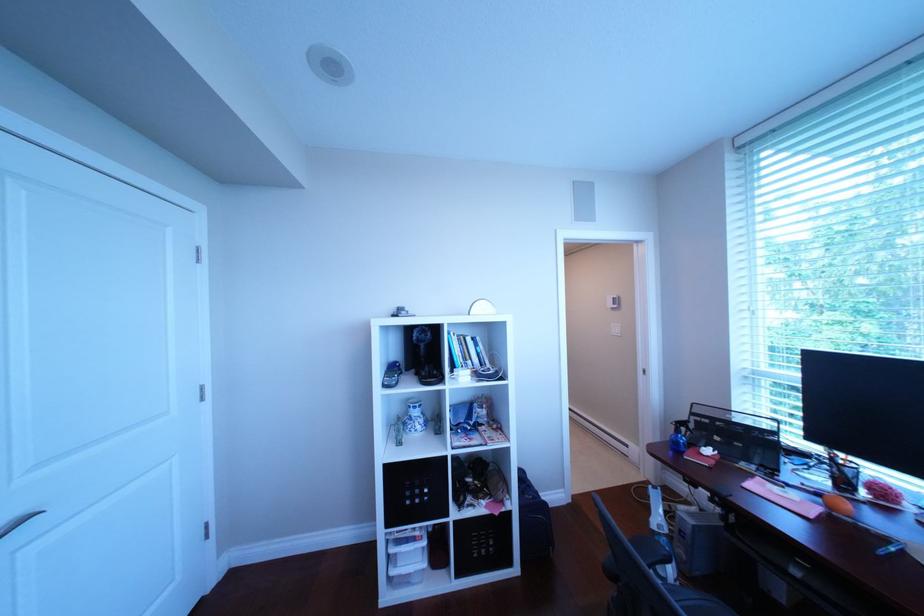
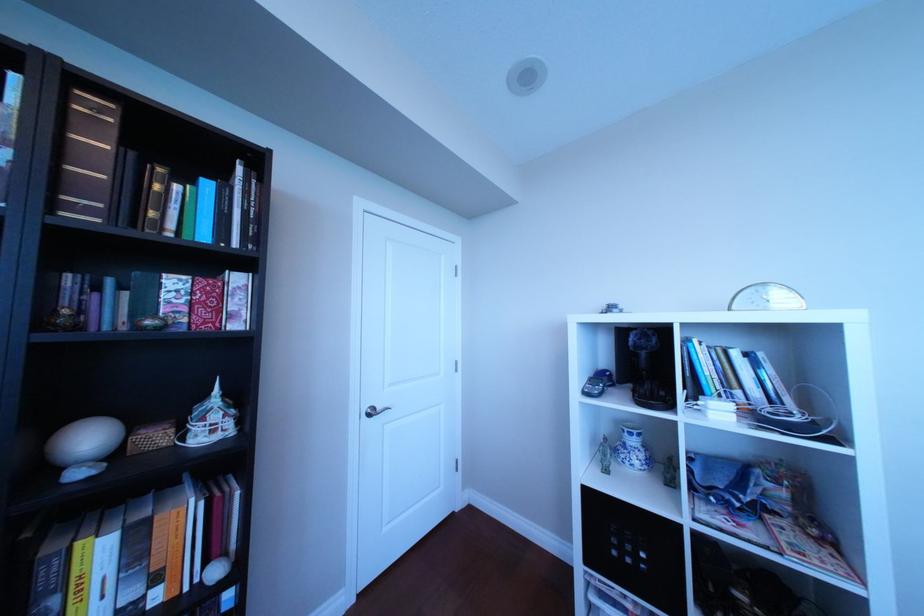
Question: Based on the continuous images, in which direction is the camera rotating? Reply with the corresponding letter.

Choices:
 (A) Left
 (B) Right
 (C) Up
 (D) Down

Answer: (A)